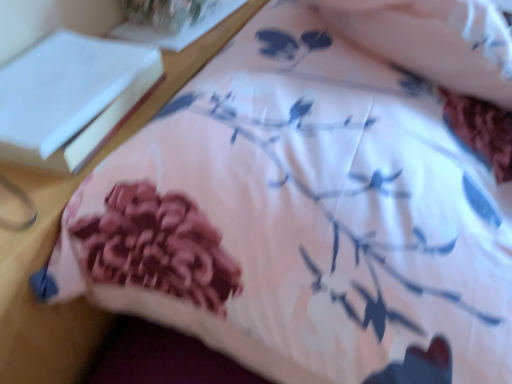
Describe the element at coordinates (70, 97) in the screenshot. Image resolution: width=512 pixels, height=384 pixels. I see `white paper at upper left, acting as the 2th book starting from the top` at that location.

This screenshot has height=384, width=512. What are the coordinates of `white paper at upper left, the first book when ordered from front to back` in the screenshot? It's located at (70, 97).

Measure the distance between point (26, 62) and camera.

Point (26, 62) and camera are 21.34 inches apart.

What is the approximate height of white paper at upper left, which is the 1th book in top-to-bottom order?

0.97 inches.

Locate an element on the screen. This screenshot has height=384, width=512. white paper at upper left, which appears as the 2th book when viewed from the front is located at coordinates (170, 20).

The image size is (512, 384). Describe the element at coordinates (170, 20) in the screenshot. I see `white paper at upper left, which is counted as the second book, starting from the bottom` at that location.

Image resolution: width=512 pixels, height=384 pixels. What are the coordinates of `white paper at upper left, the 2th book positioned from the back` in the screenshot? It's located at (70, 97).

Between white paper at upper left, the first book when ordered from front to back, and white paper at upper left, acting as the 1th book starting from the back, which one appears on the left side from the viewer's perspective?

white paper at upper left, the first book when ordered from front to back.

Considering their positions, is white paper at upper left, the 2th book positioned from the back, located in front of or behind white paper at upper left, which is the 1th book in top-to-bottom order?

In the image, white paper at upper left, the 2th book positioned from the back, appears in front of white paper at upper left, which is the 1th book in top-to-bottom order.

Considering the positions of point (24, 75) and point (175, 47), is point (24, 75) closer or farther from the camera than point (175, 47)?

Clearly, point (24, 75) is closer to the camera than point (175, 47).

From the image's perspective, is white paper at upper left, acting as the first book starting from the bottom, located above white paper at upper left, which is the 1th book in top-to-bottom order?

No, from the image's perspective, white paper at upper left, acting as the first book starting from the bottom, is not over white paper at upper left, which is the 1th book in top-to-bottom order.

From a real-world perspective, between white paper at upper left, acting as the 2th book starting from the top, and white paper at upper left, which appears as the 2th book when viewed from the front, who is vertically lower?

white paper at upper left, which appears as the 2th book when viewed from the front.

Considering the sizes of objects white paper at upper left, acting as the first book starting from the bottom, and white paper at upper left, acting as the 1th book starting from the back, in the image provided, who is thinner, white paper at upper left, acting as the first book starting from the bottom, or white paper at upper left, acting as the 1th book starting from the back,?

white paper at upper left, acting as the 1th book starting from the back, is thinner.

Considering the sizes of white paper at upper left, the 2th book positioned from the back, and white paper at upper left, which appears as the 2th book when viewed from the front, in the image, is white paper at upper left, the 2th book positioned from the back, taller or shorter than white paper at upper left, which appears as the 2th book when viewed from the front,?

In the image, white paper at upper left, the 2th book positioned from the back, appears to be taller than white paper at upper left, which appears as the 2th book when viewed from the front.

Which of these two, white paper at upper left, the first book when ordered from front to back, or white paper at upper left, which appears as the 2th book when viewed from the front, is bigger?

With larger size is white paper at upper left, the first book when ordered from front to back.

Is white paper at upper left, acting as the 2th book starting from the top, positioned beyond the bounds of white paper at upper left, acting as the 1th book starting from the back?

Yes, white paper at upper left, acting as the 2th book starting from the top, is located beyond the bounds of white paper at upper left, acting as the 1th book starting from the back.

Does white paper at upper left, the first book when ordered from front to back, touch white paper at upper left, which is the 1th book in top-to-bottom order?

No, white paper at upper left, the first book when ordered from front to back, is not beside white paper at upper left, which is the 1th book in top-to-bottom order.

Could you tell me if white paper at upper left, the 2th book positioned from the back, is turned towards white paper at upper left, which is the 1th book in top-to-bottom order?

No.

Where is `book that appears below the white paper at upper left, which is the 1th book in top-to-bottom order (from the image's perspective)`? The height and width of the screenshot is (384, 512). book that appears below the white paper at upper left, which is the 1th book in top-to-bottom order (from the image's perspective) is located at coordinates (70, 97).

In the scene shown: Can you confirm if white paper at upper left, which appears as the 2th book when viewed from the front, is positioned to the left of white paper at upper left, the first book when ordered from front to back?

No.

Considering the relative positions of white paper at upper left, which is counted as the second book, starting from the bottom, and white paper at upper left, acting as the first book starting from the bottom, in the image provided, is white paper at upper left, which is counted as the second book, starting from the bottom, behind white paper at upper left, acting as the first book starting from the bottom,?

Yes, the depth of white paper at upper left, which is counted as the second book, starting from the bottom, is greater than that of white paper at upper left, acting as the first book starting from the bottom.

Is point (174, 43) closer or farther from the camera than point (42, 130)?

Point (174, 43) is farther from the camera than point (42, 130).

From the image's perspective, which one is positioned lower, white paper at upper left, which is the 1th book in top-to-bottom order, or white paper at upper left, the first book when ordered from front to back?

white paper at upper left, the first book when ordered from front to back.

From a real-world perspective, is white paper at upper left, acting as the 1th book starting from the back, on white paper at upper left, the 2th book positioned from the back?

No, from a real-world perspective, white paper at upper left, acting as the 1th book starting from the back, is not on top of white paper at upper left, the 2th book positioned from the back.

Can you confirm if white paper at upper left, which appears as the 2th book when viewed from the front, is wider than white paper at upper left, acting as the first book starting from the bottom?

No, white paper at upper left, which appears as the 2th book when viewed from the front, is not wider than white paper at upper left, acting as the first book starting from the bottom.

Considering the sizes of white paper at upper left, acting as the 1th book starting from the back, and white paper at upper left, acting as the 2th book starting from the top, in the image, is white paper at upper left, acting as the 1th book starting from the back, taller or shorter than white paper at upper left, acting as the 2th book starting from the top,?

white paper at upper left, acting as the 1th book starting from the back, is shorter than white paper at upper left, acting as the 2th book starting from the top.

Does white paper at upper left, which appears as the 2th book when viewed from the front, have a larger size compared to white paper at upper left, acting as the 2th book starting from the top?

No.

Is white paper at upper left, the 2th book positioned from the back, inside white paper at upper left, acting as the 1th book starting from the back?

No.

Is white paper at upper left, which is the 1th book in top-to-bottom order, positioned far away from white paper at upper left, acting as the first book starting from the bottom?

No, there isn't a large distance between white paper at upper left, which is the 1th book in top-to-bottom order, and white paper at upper left, acting as the first book starting from the bottom.

Is white paper at upper left, which appears as the 2th book when viewed from the front, facing away from white paper at upper left, the first book when ordered from front to back?

No, white paper at upper left, which appears as the 2th book when viewed from the front, is not facing away from white paper at upper left, the first book when ordered from front to back.

Can you tell me how much white paper at upper left, which is counted as the second book, starting from the bottom, and white paper at upper left, the 2th book positioned from the back, differ in facing direction?

There is a 8.6-degree angle between the facing directions of white paper at upper left, which is counted as the second book, starting from the bottom, and white paper at upper left, the 2th book positioned from the back.

How much distance is there between white paper at upper left, which appears as the 2th book when viewed from the front, and white paper at upper left, the 2th book positioned from the back?

A distance of 7.19 inches exists between white paper at upper left, which appears as the 2th book when viewed from the front, and white paper at upper left, the 2th book positioned from the back.

Find the location of a particular element. book located on the right of white paper at upper left, the first book when ordered from front to back is located at coordinates (170, 20).

There is a white paper at upper left, which appears as the 2th book when viewed from the front. Identify the location of book above it (from a real-world perspective). Image resolution: width=512 pixels, height=384 pixels. pos(70,97).

Where is `book located on the left of white paper at upper left, which is the 1th book in top-to-bottom order`? Image resolution: width=512 pixels, height=384 pixels. book located on the left of white paper at upper left, which is the 1th book in top-to-bottom order is located at coordinates (70, 97).